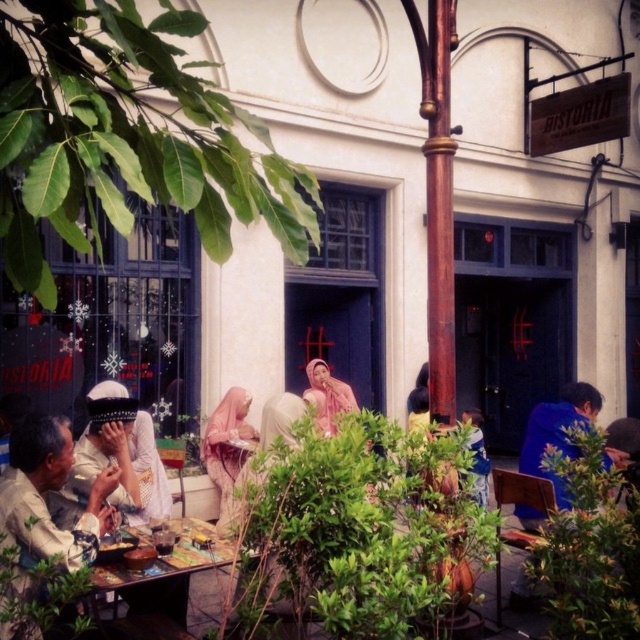
You are a customer at BISTORIA and want to place your coffee mug on the wooden table at center. However, there is a pale pink fabric at center already on the table. Can you fit your mug there without moving the fabric?

The wooden table at center has a larger size compared to the pale pink fabric at center, so there should be enough space to place your coffee mug without moving the fabric.

You are standing in the outdoor cafe area and want to walk towards the building. Which of the two points, point [172,582] or point [212,432], would you reach first?

Point [172,582] is closer to the viewer than point [212,432], so you would reach point [172,582] first.